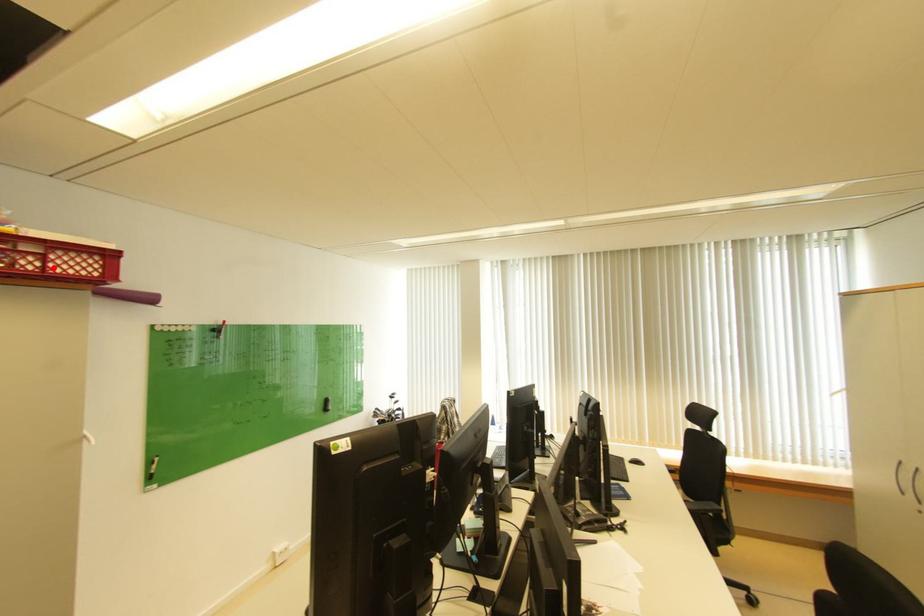
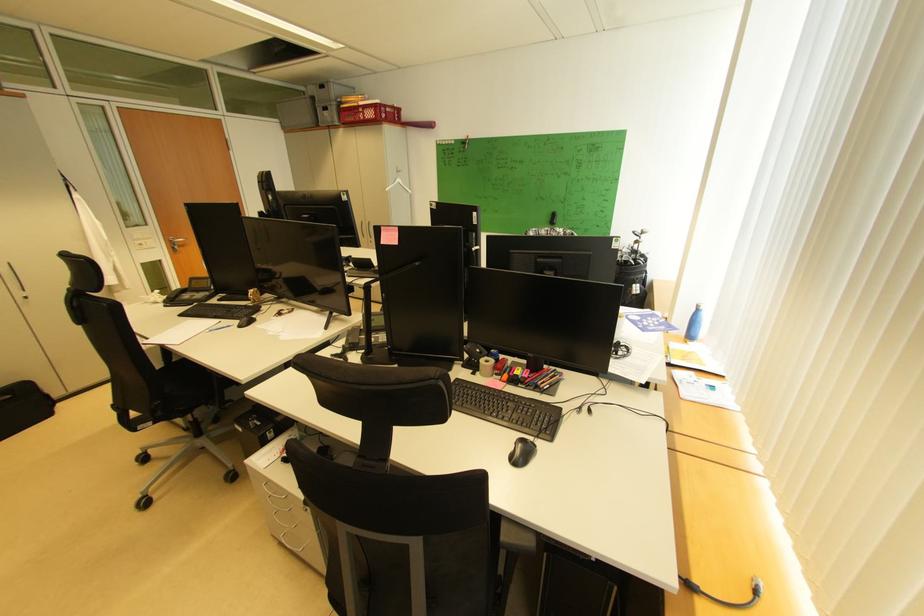
In the second image, find the point that corresponds to the highlighted location in the first image.

(372, 118)